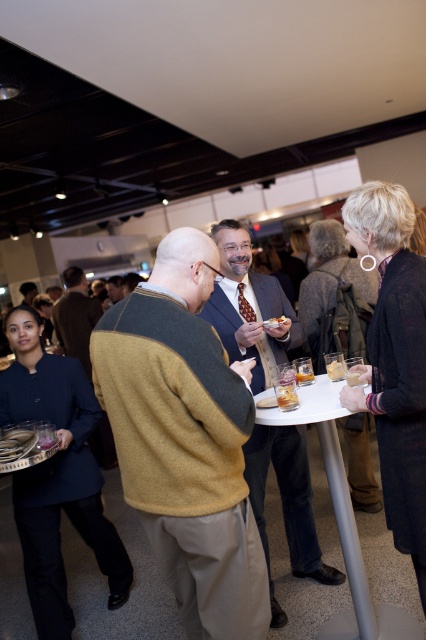
Between point (386, 204) and point (279, 452), which one is positioned behind?

The point (279, 452) is behind.

Measure the distance between dark blue wool coat at center and camera.

A distance of 4.69 feet exists between dark blue wool coat at center and camera.

Is point (425, 410) positioned after point (244, 472)?

No.

In order to click on dark blue wool coat at center in this screenshot , I will do `click(394, 358)`.

Between brown textured coat at center and light brown sweater at center, which one is positioned lower?

light brown sweater at center is below.

Is brown textured coat at center bigger than light brown sweater at center?

No, brown textured coat at center is not bigger than light brown sweater at center.

This screenshot has width=426, height=640. In order to click on brown textured coat at center in this screenshot , I will do `click(330, 275)`.

The height and width of the screenshot is (640, 426). I want to click on brown textured coat at center, so click(x=330, y=275).

Is point (247, 580) behind point (348, 371)?

No, it is not.

Is the position of knit sweater at center more distant than that of translucent glass at center?

No, knit sweater at center is in front of translucent glass at center.

Does point (198, 276) lie behind point (345, 380)?

No, it is in front of (345, 380).

Locate an element on the screen. The height and width of the screenshot is (640, 426). knit sweater at center is located at coordinates (184, 440).